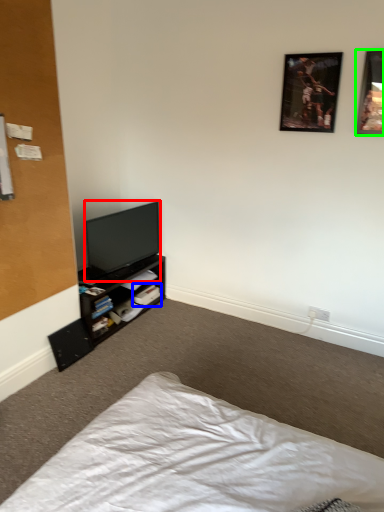
Question: Considering the real-world distances, which object is farthest from television (highlighted by a red box)? book (highlighted by a blue box) or picture frame (highlighted by a green box)?

Choices:
 (A) book
 (B) picture frame

Answer: (B)